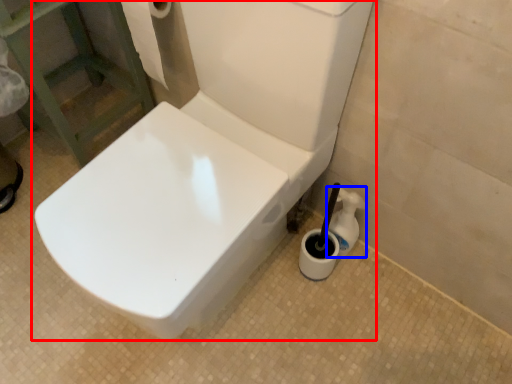
Question: Which point is further to the camera, toilet (highlighted by a red box) or cleaning product (highlighted by a blue box)?

Choices:
 (A) toilet
 (B) cleaning product

Answer: (B)